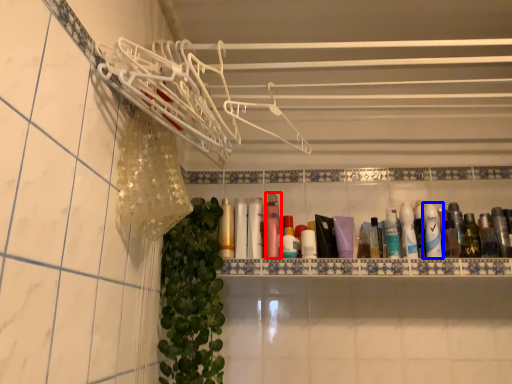
Question: Which of the following is the closest to the observer, mouthwash (highlighted by a red box) or shaving cream (highlighted by a blue box)?

Choices:
 (A) mouthwash
 (B) shaving cream

Answer: (B)